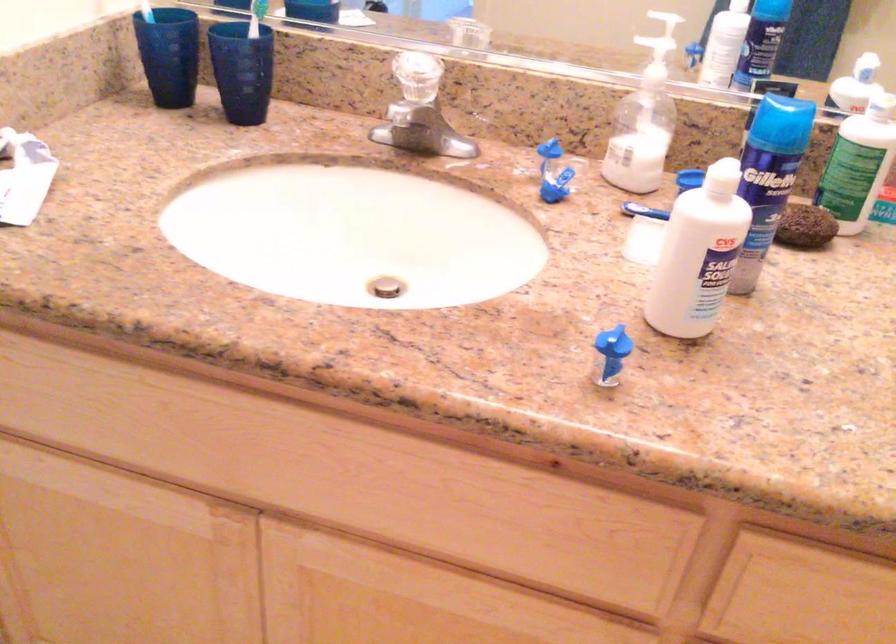
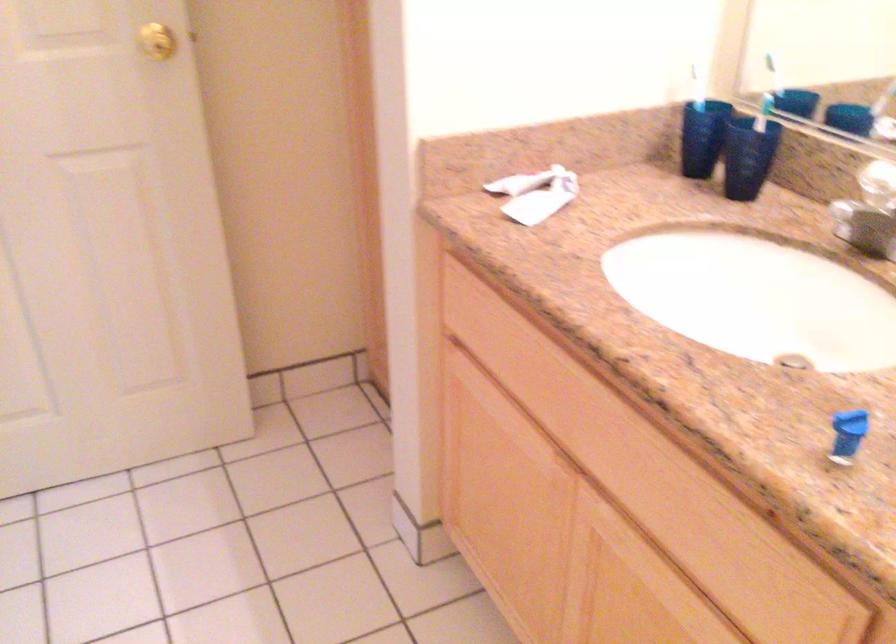
Question: How did the camera likely rotate?

Choices:
 (A) Left
 (B) Right
 (C) Up
 (D) Down

Answer: (A)